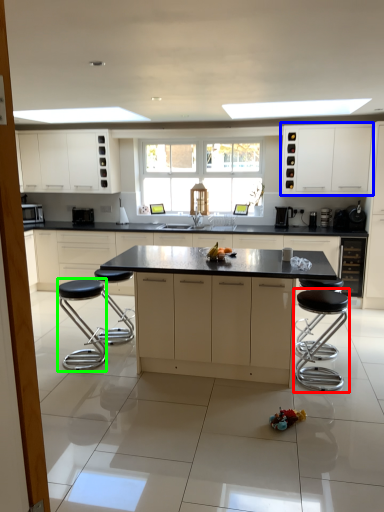
Question: Based on their relative distances, which object is nearer to bar stool (highlighted by a red box)? Choose from cabinetry (highlighted by a blue box) and bar stool (highlighted by a green box).

Choices:
 (A) cabinetry
 (B) bar stool

Answer: (B)